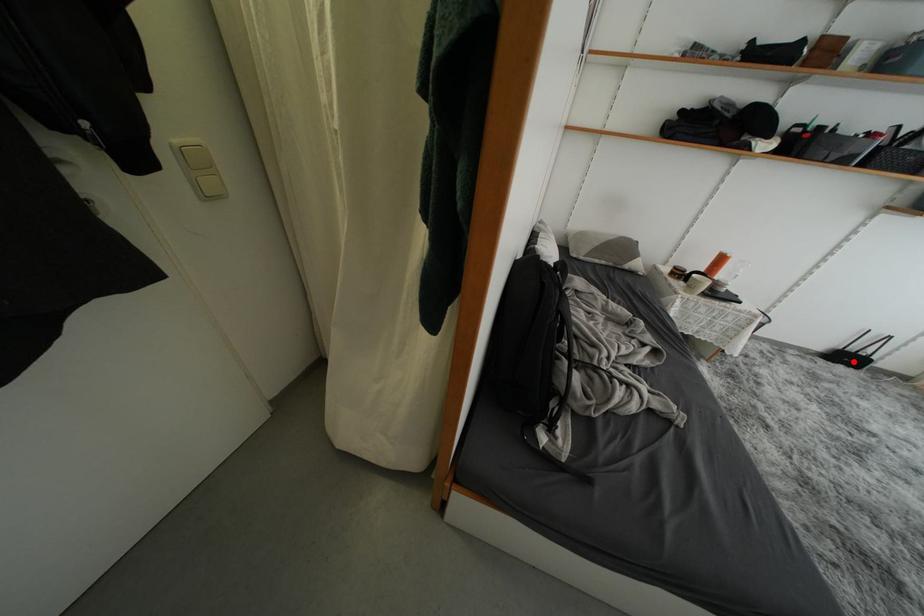
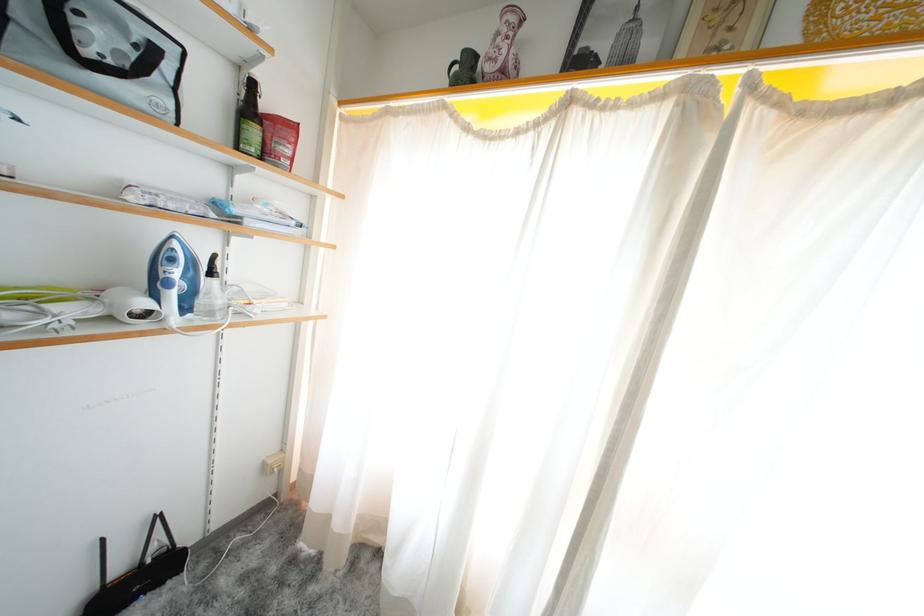
Question: I am providing you with two images of the same scene from different viewpoints. Given a red point in image1, look at the same physical point in image2. Is it:

Choices:
 (A) Closer to the viewpoint
 (B) Farther from the viewpoint

Answer: (A)